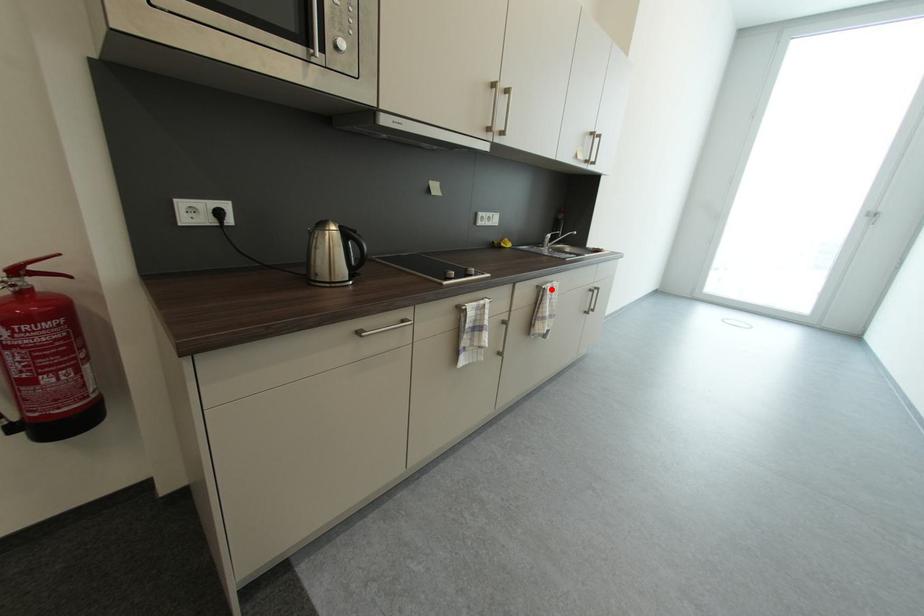
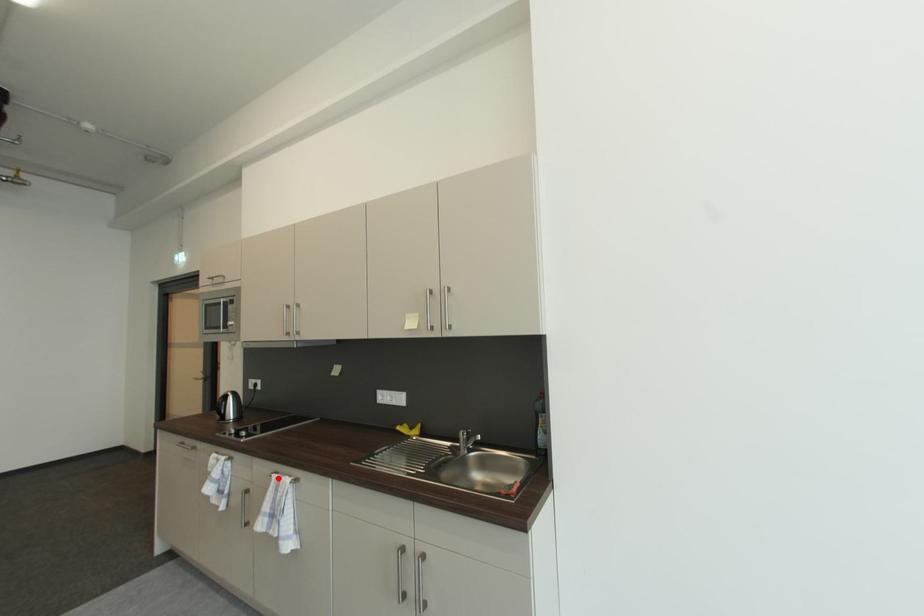
I am providing you with two images of the same scene from different viewpoints. A red point is marked on the first image and another point is marked on the second image. Are the points marked in image1 and image2 representing the same 3D position?

Yes